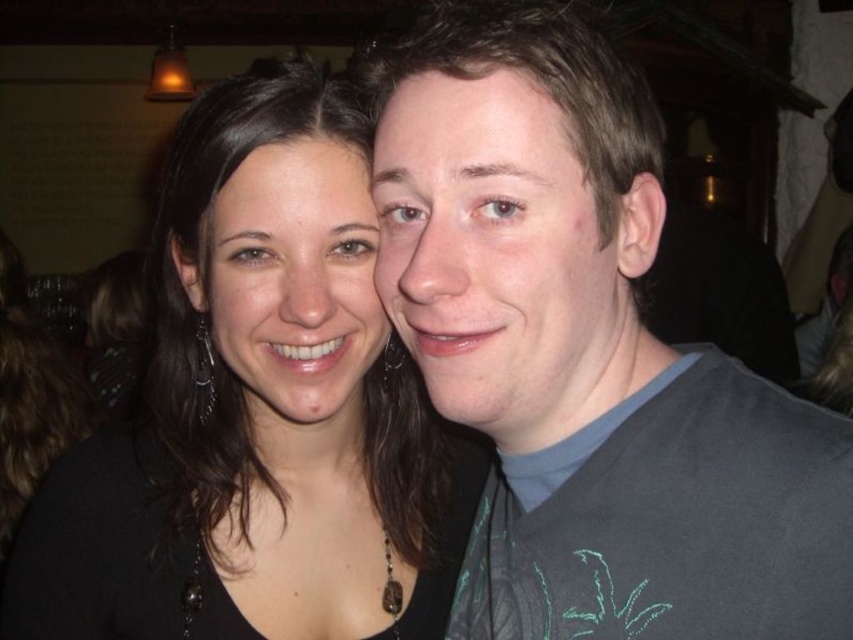
Question: Does gray fabric shirt at center have a smaller size compared to black matte hair at center?

Choices:
 (A) no
 (B) yes

Answer: (B)

Question: Does gray fabric shirt at center have a greater width compared to black matte hair at center?

Choices:
 (A) yes
 (B) no

Answer: (B)

Question: In this image, where is gray fabric shirt at center located relative to black matte hair at center?

Choices:
 (A) above
 (B) below

Answer: (A)

Question: Which object is closer to the camera taking this photo?

Choices:
 (A) black matte hair at center
 (B) gray fabric shirt at center

Answer: (B)